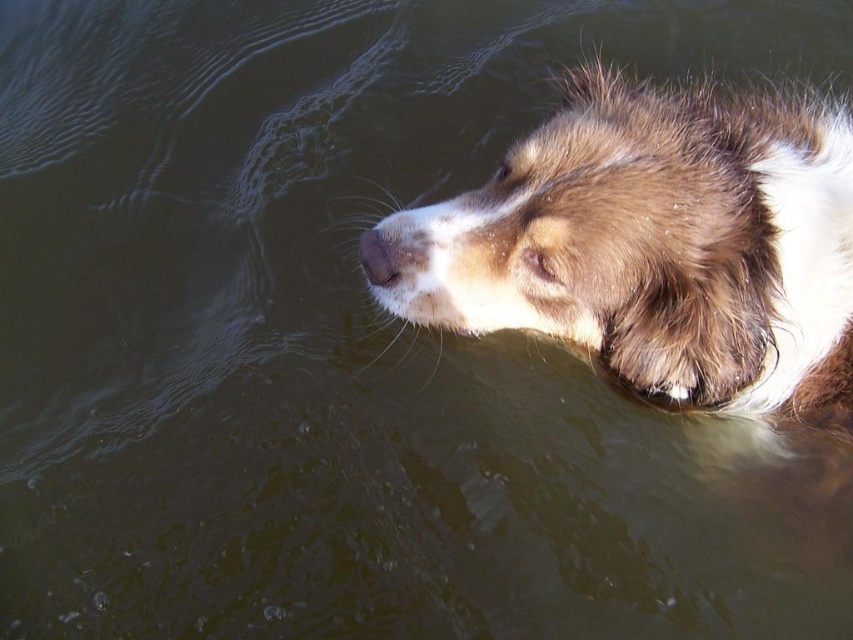
Question: Which point appears closest to the camera in this image?

Choices:
 (A) (386, 241)
 (B) (610, 221)

Answer: (B)

Question: Does brown fuzzy dog at upper center appear on the right side of brown matte nose at upper center?

Choices:
 (A) no
 (B) yes

Answer: (B)

Question: Is the position of brown fuzzy dog at upper center more distant than that of brown matte nose at upper center?

Choices:
 (A) yes
 (B) no

Answer: (B)

Question: Is brown fuzzy dog at upper center positioned before brown matte nose at upper center?

Choices:
 (A) yes
 (B) no

Answer: (A)